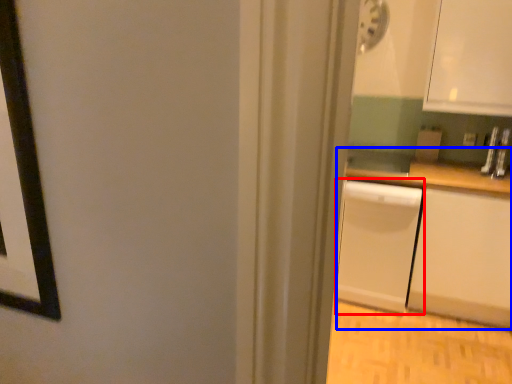
Question: Which point is closer to the camera, dish washer (highlighted by a red box) or counter (highlighted by a blue box)?

Choices:
 (A) dish washer
 (B) counter

Answer: (B)